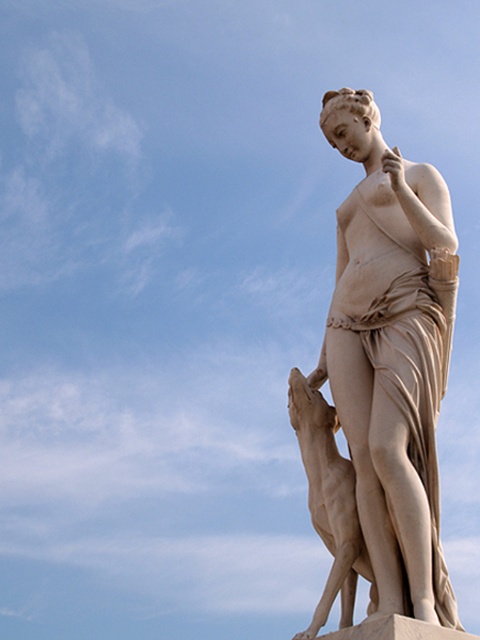
Question: Is white marble statue at center in front of matte stone dog at lower center?

Choices:
 (A) yes
 (B) no

Answer: (A)

Question: Which of the following is the closest to the observer?

Choices:
 (A) white marble statue at center
 (B) matte stone dog at lower center

Answer: (A)

Question: Is white marble statue at center smaller than matte stone dog at lower center?

Choices:
 (A) no
 (B) yes

Answer: (A)

Question: Among these points, which one is farthest from the camera?

Choices:
 (A) (323, 525)
 (B) (370, 262)

Answer: (B)

Question: Is white marble statue at center positioned at the back of matte stone dog at lower center?

Choices:
 (A) no
 (B) yes

Answer: (A)